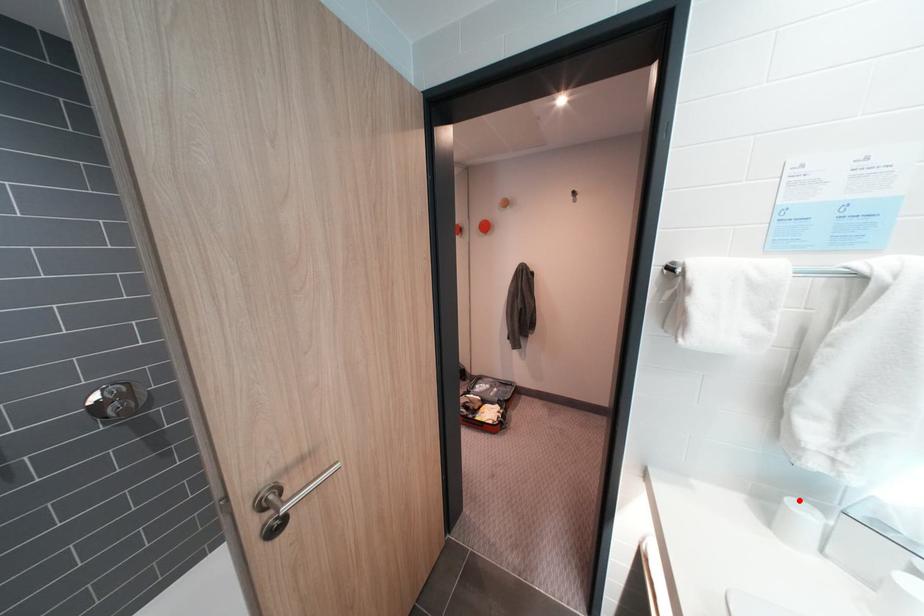
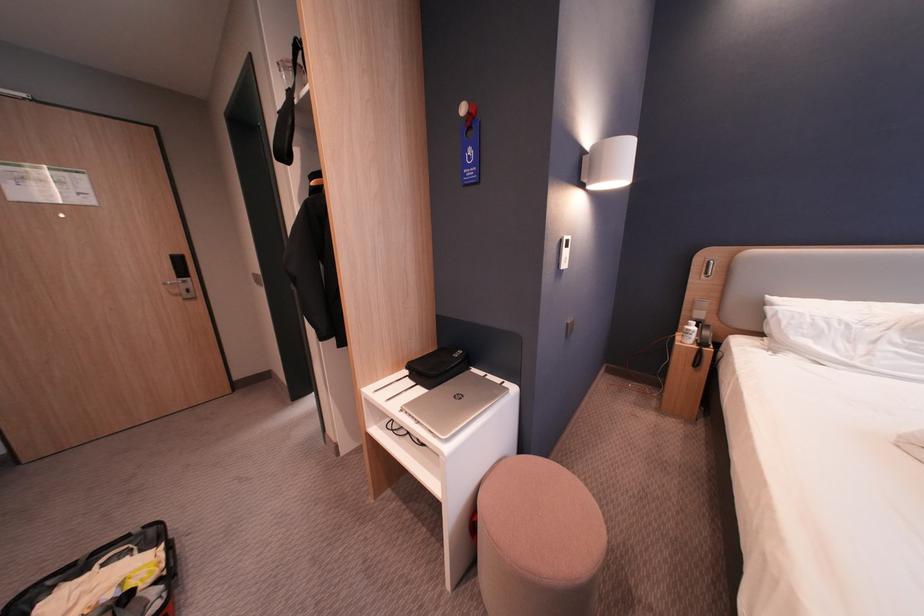
Question: I am providing you with two images of the same scene from different viewpoints. A red point is marked on the first image. Can you still see the location of the red point in image 2?

Choices:
 (A) Yes
 (B) No

Answer: (B)